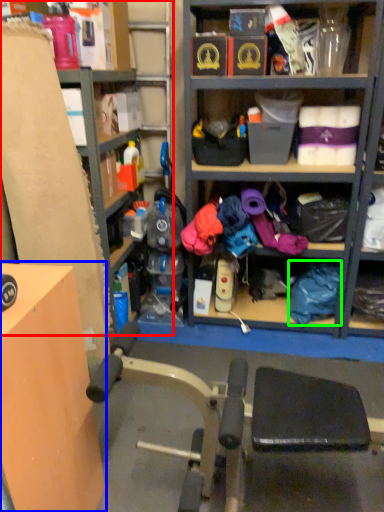
Question: Based on their relative distances, which object is farther from shelf (highlighted by a red box)? Choose from table (highlighted by a blue box) and clothing (highlighted by a green box).

Choices:
 (A) table
 (B) clothing

Answer: (B)